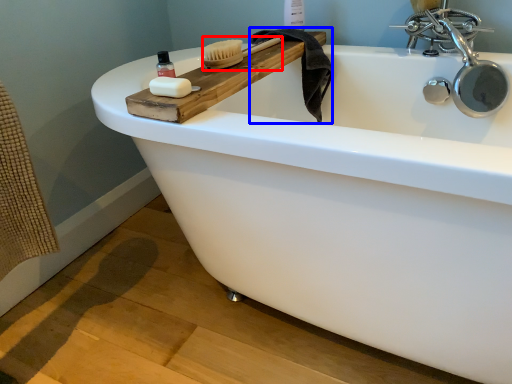
Question: Which object is further to the camera taking this photo, brush (highlighted by a red box) or bath towel (highlighted by a blue box)?

Choices:
 (A) brush
 (B) bath towel

Answer: (B)